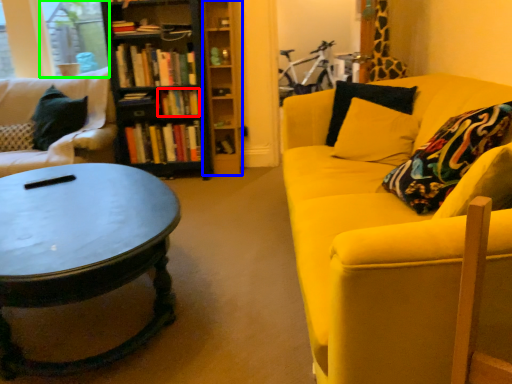
Question: Which object is positioned closest to book (highlighted by a red box)? Select from shelf (highlighted by a blue box) and window screen (highlighted by a green box).

Choices:
 (A) shelf
 (B) window screen

Answer: (A)